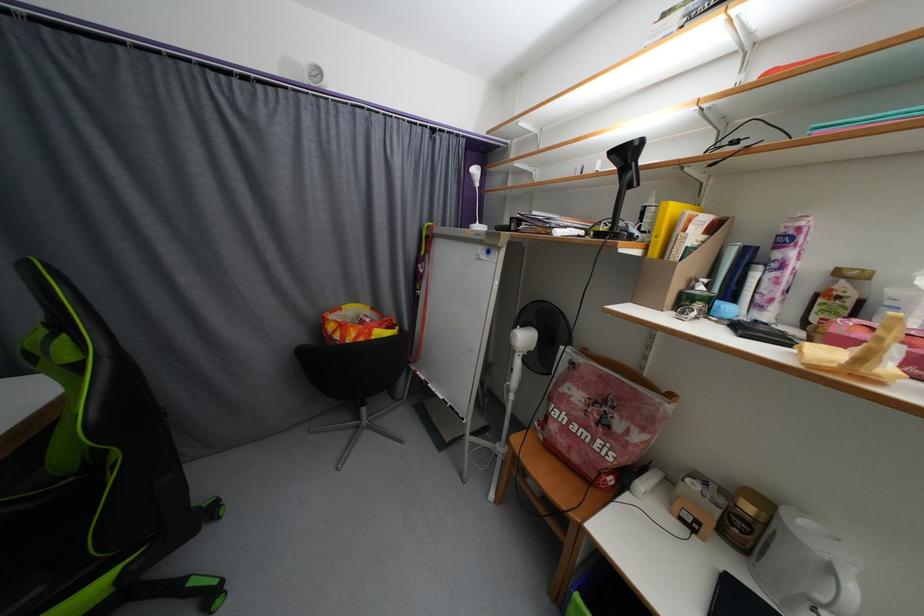
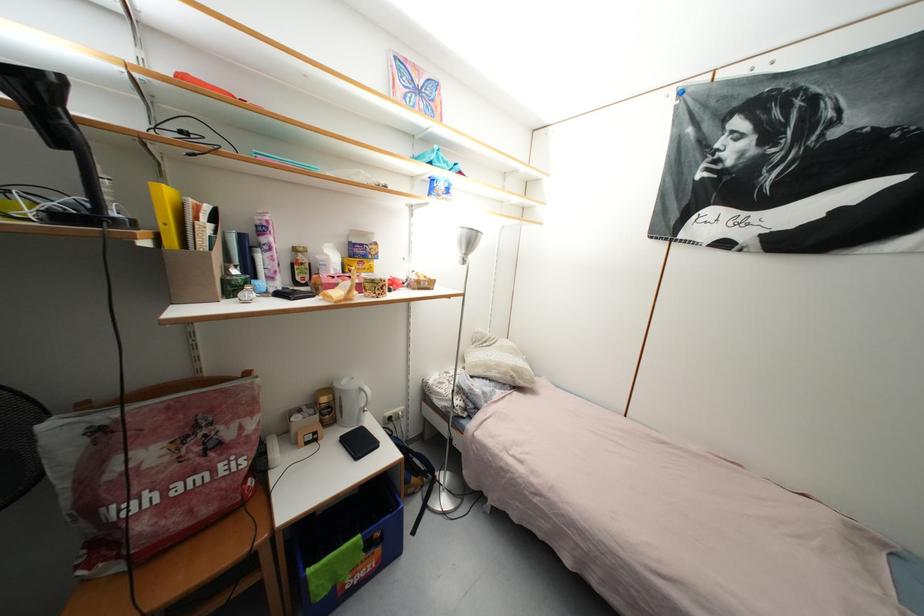
The images are taken continuously from a first-person perspective. In which direction is your viewpoint rotating?

The rotation direction of the camera is right-down.